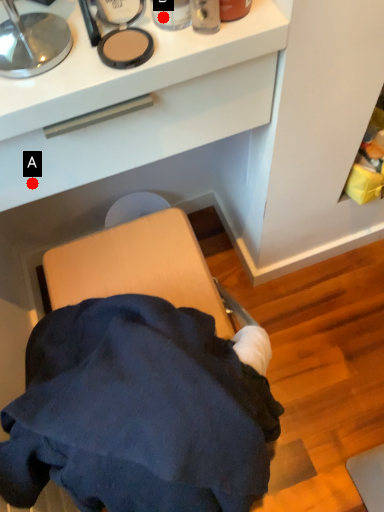
Question: Two points are circled on the image, labeled by A and B beside each circle. Which point is closer to the camera taking this photo?

Choices:
 (A) A is closer
 (B) B is closer

Answer: (B)